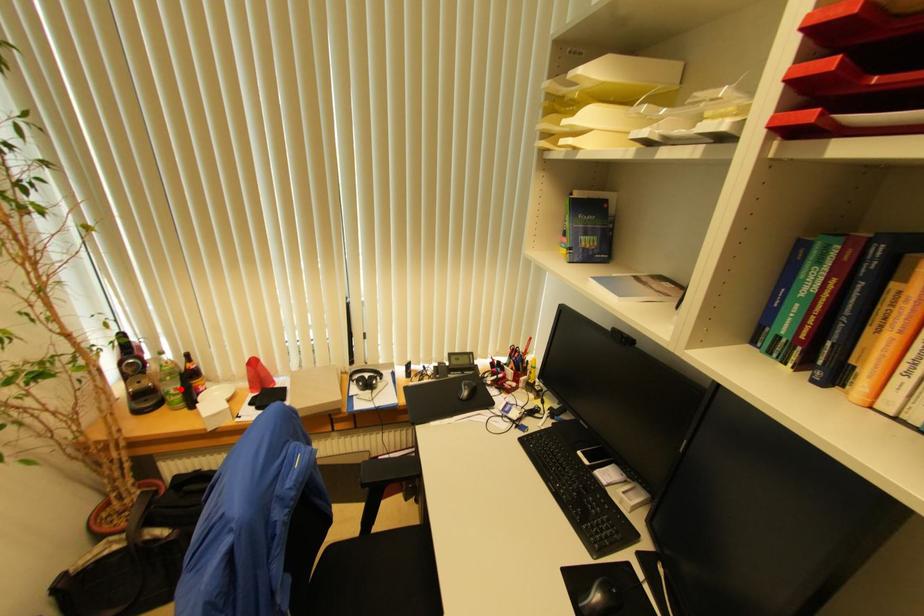
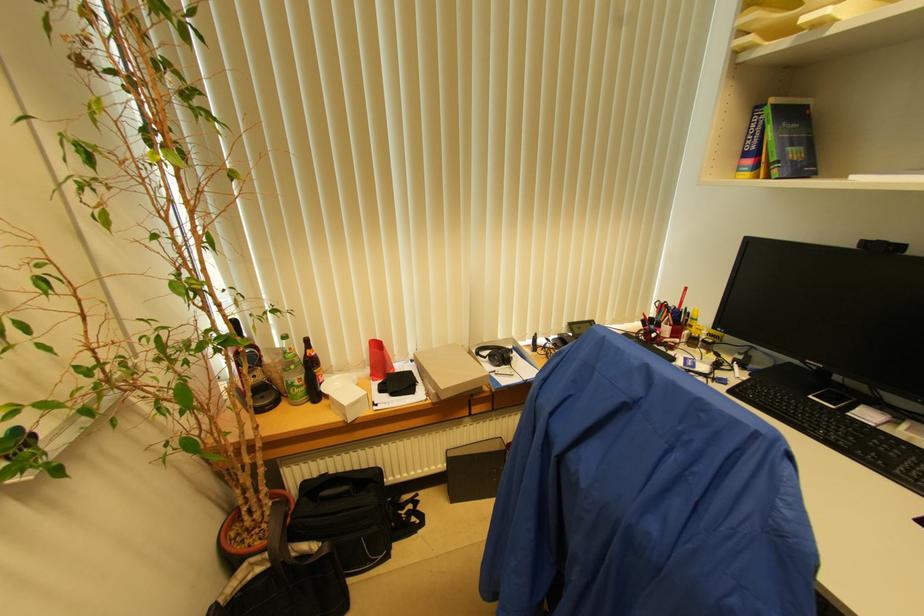
Where in the second image is the point corresponding to the highlighted location from the first image?

(304, 379)